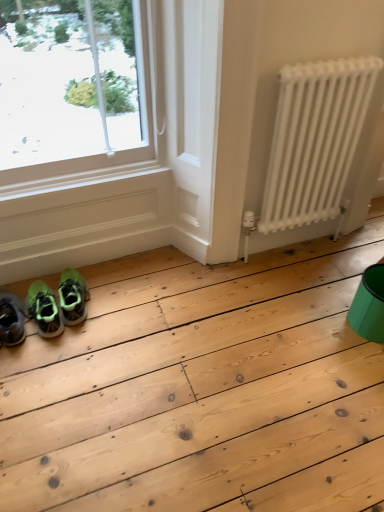
Question: From the image's perspective, is teal plastic bucket at lower right under white matte radiator at right?

Choices:
 (A) no
 (B) yes

Answer: (B)

Question: From a real-world perspective, is teal plastic bucket at lower right positioned under white matte radiator at right based on gravity?

Choices:
 (A) no
 (B) yes

Answer: (B)

Question: Can we say teal plastic bucket at lower right lies outside white matte radiator at right?

Choices:
 (A) no
 (B) yes

Answer: (B)

Question: Considering the relative positions of teal plastic bucket at lower right and white matte radiator at right in the image provided, is teal plastic bucket at lower right to the left of white matte radiator at right from the viewer's perspective?

Choices:
 (A) yes
 (B) no

Answer: (B)

Question: Is teal plastic bucket at lower right turned away from white matte radiator at right?

Choices:
 (A) no
 (B) yes

Answer: (B)

Question: From a real-world perspective, is teal plastic bucket at lower right physically located above or below green matte sneakers at lower left?

Choices:
 (A) below
 (B) above

Answer: (B)

Question: Which is correct: teal plastic bucket at lower right is inside green matte sneakers at lower left, or outside of it?

Choices:
 (A) outside
 (B) inside

Answer: (A)

Question: From their relative heights in the image, would you say teal plastic bucket at lower right is taller or shorter than green matte sneakers at lower left?

Choices:
 (A) tall
 (B) short

Answer: (A)

Question: Considering the positions of teal plastic bucket at lower right and green matte sneakers at lower left in the image, is teal plastic bucket at lower right bigger or smaller than green matte sneakers at lower left?

Choices:
 (A) big
 (B) small

Answer: (A)

Question: From a real-world perspective, relative to white matte radiator at right, is green matte sneakers at lower left vertically above or below?

Choices:
 (A) below
 (B) above

Answer: (A)

Question: Is green matte sneakers at lower left taller or shorter than white matte radiator at right?

Choices:
 (A) tall
 (B) short

Answer: (B)

Question: From the image's perspective, is green matte sneakers at lower left positioned above or below white matte radiator at right?

Choices:
 (A) below
 (B) above

Answer: (A)

Question: Is green matte sneakers at lower left in front of or behind white matte radiator at right in the image?

Choices:
 (A) behind
 (B) front

Answer: (A)

Question: Visually, is green matte sneakers at lower left positioned to the left or to the right of teal plastic bucket at lower right?

Choices:
 (A) left
 (B) right

Answer: (A)

Question: Looking at the image, does green matte sneakers at lower left seem bigger or smaller compared to teal plastic bucket at lower right?

Choices:
 (A) small
 (B) big

Answer: (A)